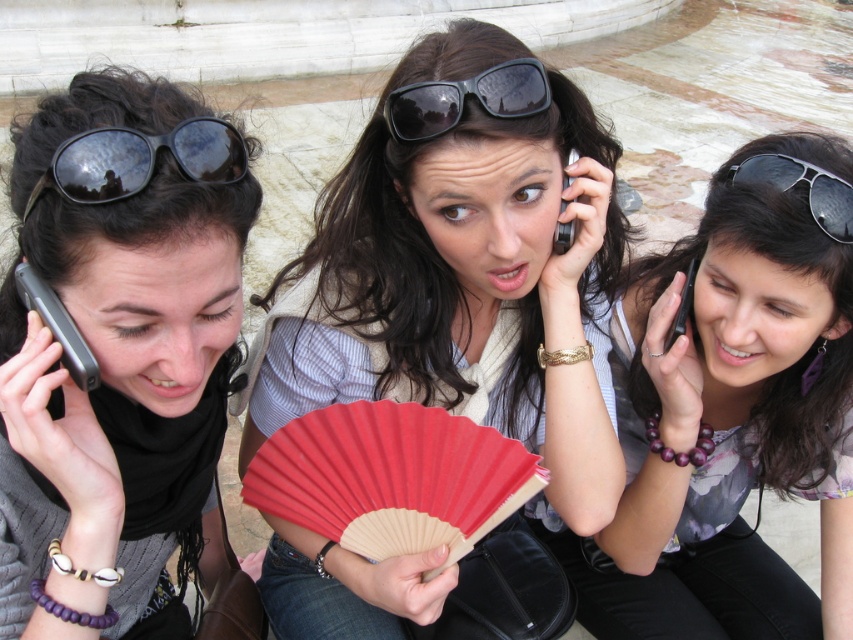
In the scene shown: You are standing in a plaza and see three women talking. You need to locate the black aviator sunglasses at upper right. Where exactly are they positioned in the image?

The black aviator sunglasses at upper right are positioned at point (807,192) in the image.

You are a photographer trying to capture a candid shot of the purple beaded bracelet at center and the black aviator sunglasses at upper right. Which object should you focus on first if you want to start with the one closer to the left side of the frame?

The black aviator sunglasses at upper right are to the left of the purple beaded bracelet at center, so you should focus on the black aviator sunglasses at upper right first.